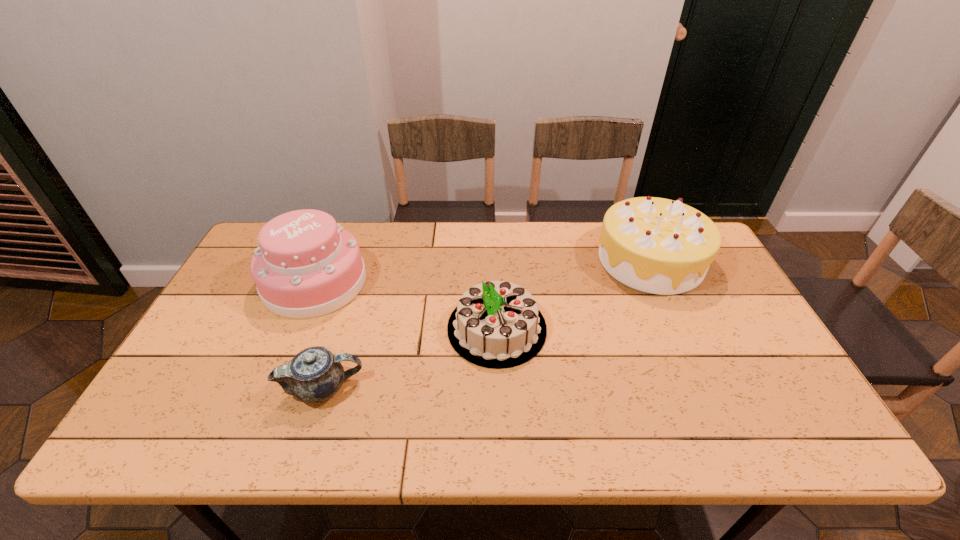
The width and height of the screenshot is (960, 540). I want to click on object that is at the far left corner, so click(307, 265).

Locate an element on the screen. The height and width of the screenshot is (540, 960). object at the far right corner is located at coordinates 655,245.

I want to click on free space at the far edge of the desktop, so click(384, 263).

In the image, there is a desktop. Where is `vacant space at the near edge`? The image size is (960, 540). vacant space at the near edge is located at coordinates (334, 441).

Find the location of a particular element. Image resolution: width=960 pixels, height=540 pixels. vacant space at the left edge of the desktop is located at coordinates (196, 393).

Where is `free spot at the right edge of the desktop`? This screenshot has width=960, height=540. free spot at the right edge of the desktop is located at coordinates (705, 284).

Identify the location of free point between the third object from left to right and the chinaware. This screenshot has height=540, width=960. (410, 358).

At what (x,y) coordinates should I click in order to perform the action: click on vacant region between the leftmost birthday cake and the rightmost birthday cake. Please return your answer as a coordinate pair (x, y). This screenshot has height=540, width=960. Looking at the image, I should click on (483, 271).

Locate an element on the screen. free spot between the leftmost birthday cake and the shortest object is located at coordinates (319, 335).

Identify the location of free space between the leftmost birthday cake and the rightmost birthday cake. The image size is (960, 540). pyautogui.click(x=483, y=271).